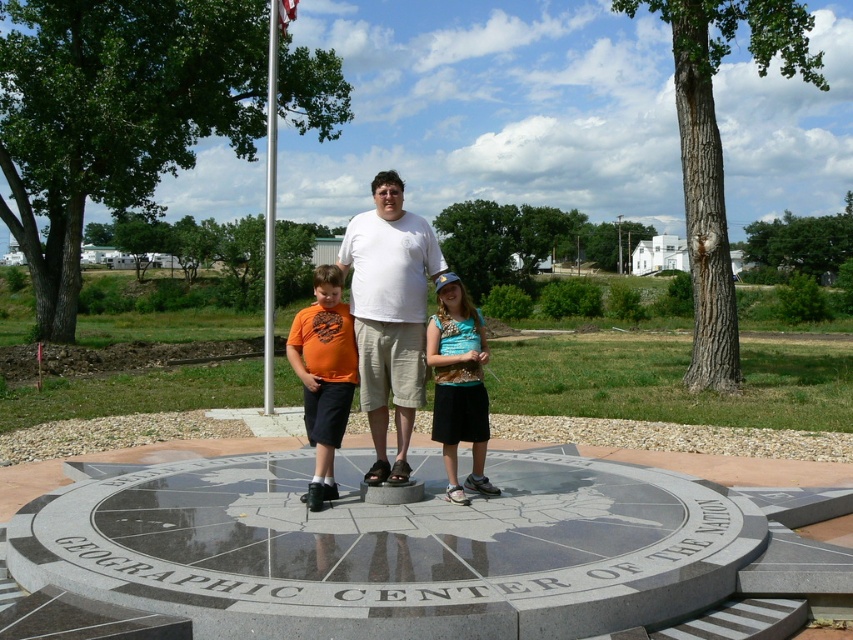
Question: Among these points, which one is farthest from the camera?

Choices:
 (A) (280, 19)
 (B) (294, 321)
 (C) (436, 428)
 (D) (397, 419)

Answer: (A)

Question: Does turquoise fabric shirt at center appear under metallic flag pole at center?

Choices:
 (A) no
 (B) yes

Answer: (B)

Question: Which point is farther to the camera?

Choices:
 (A) red fabric flag at upper center
 (B) orange matte shirt at center
 (C) white matte shirt at center

Answer: (A)

Question: From the image, what is the correct spatial relationship of turquoise fabric shirt at center in relation to metallic flag pole at center?

Choices:
 (A) left
 (B) right

Answer: (B)

Question: Can you confirm if orange matte shirt at center is smaller than turquoise fabric shirt at center?

Choices:
 (A) yes
 (B) no

Answer: (B)

Question: Which point is farther to the camera?

Choices:
 (A) (267, 122)
 (B) (283, 13)

Answer: (A)